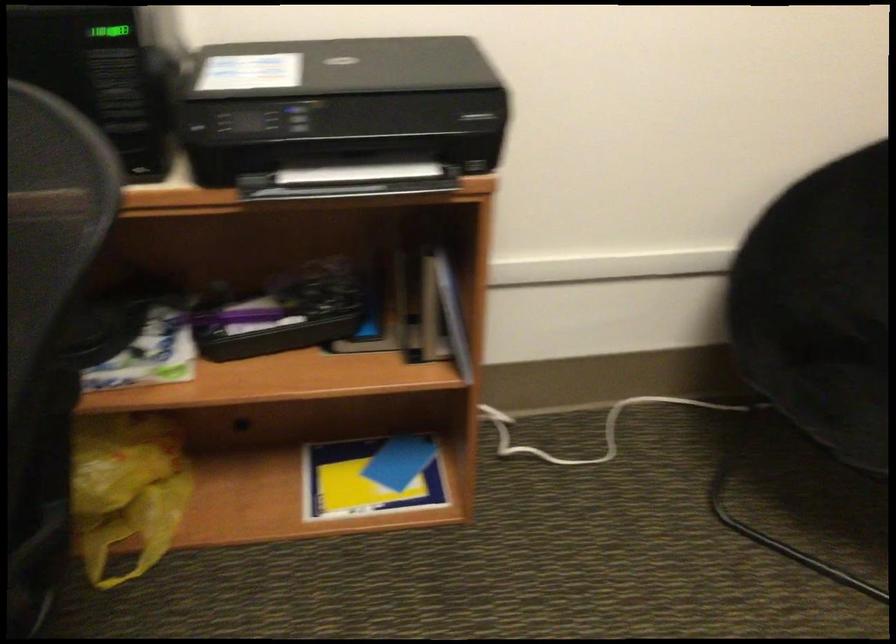
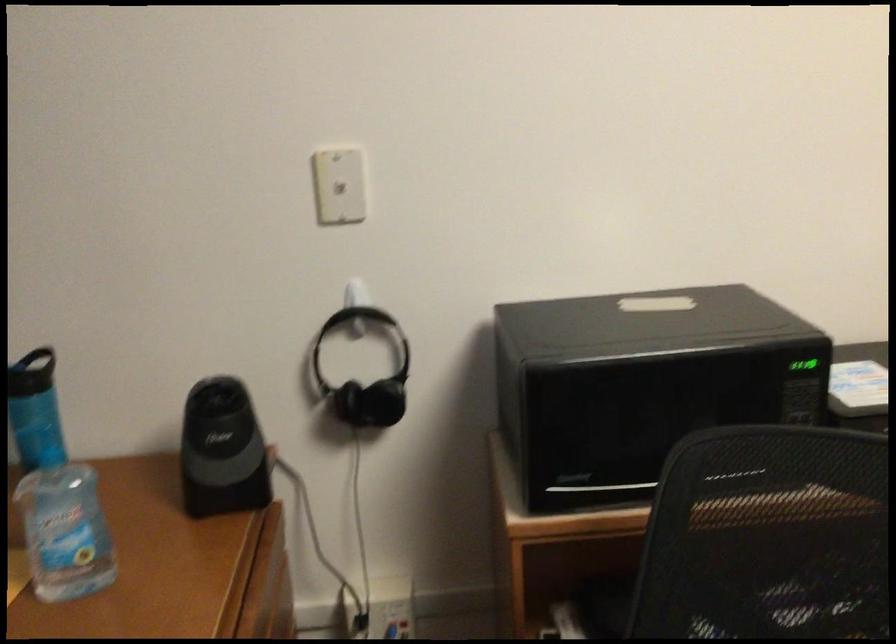
Question: The images are taken continuously from a first-person perspective. In which direction is your viewpoint rotating?

Choices:
 (A) Left
 (B) Right
 (C) Up
 (D) Down

Answer: (C)